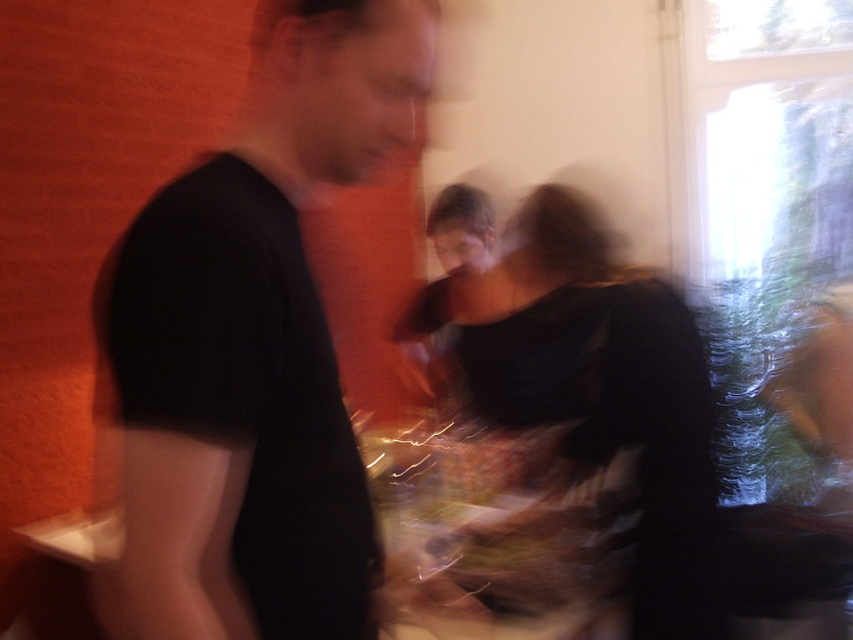
Question: Does black matte shirt at left come behind matte black dress at center?

Choices:
 (A) no
 (B) yes

Answer: (A)

Question: Does black matte shirt at left appear over matte black dress at center?

Choices:
 (A) no
 (B) yes

Answer: (B)

Question: Which object is farther from the camera taking this photo?

Choices:
 (A) black matte shirt at left
 (B) matte black dress at center

Answer: (B)

Question: Among these points, which one is farthest from the camera?

Choices:
 (A) (657, 394)
 (B) (219, 202)

Answer: (A)

Question: Does black matte shirt at left have a greater width compared to matte black dress at center?

Choices:
 (A) no
 (B) yes

Answer: (A)